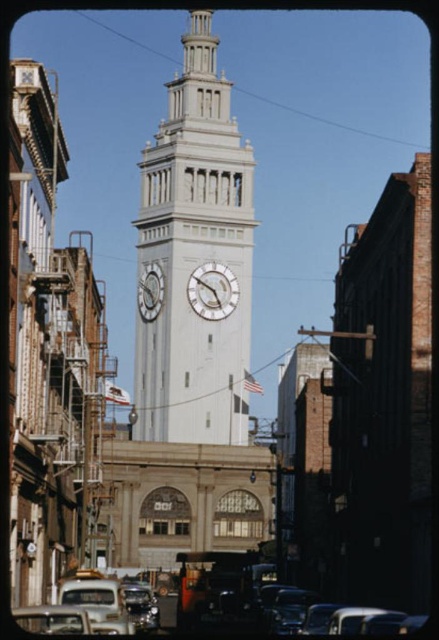
You are a photographer standing at the end of the street wanting to capture both the white stone clock tower at center and the metallic silver car at center in a single frame. Based on their sizes, which object will appear larger in the photo?

The white stone clock tower at center will appear larger in the photo because it has a greater height compared to the metallic silver car at center.

You are a city planner reviewing this street layout. You need to install a new streetlight that must be shorter than both the white stone clock tower at center and the white wooden clock at center. Which clock should the streetlight be placed closer to if you want it to be less likely to block the view of the taller structure?

The streetlight should be placed closer to the white wooden clock at center because the white stone clock tower at center is taller. Placing the streetlight near the shorter white wooden clock at center reduces the chance of blocking the view of the taller tower.

You are a tourist standing at the entrance of the street leading to the clock tower. You see the white stone clock tower at center and the white wooden clock at center. Which one is closer to you?

The white wooden clock at center is closer to you because the white stone clock tower at center is positioned over it, meaning the wooden clock is in front.